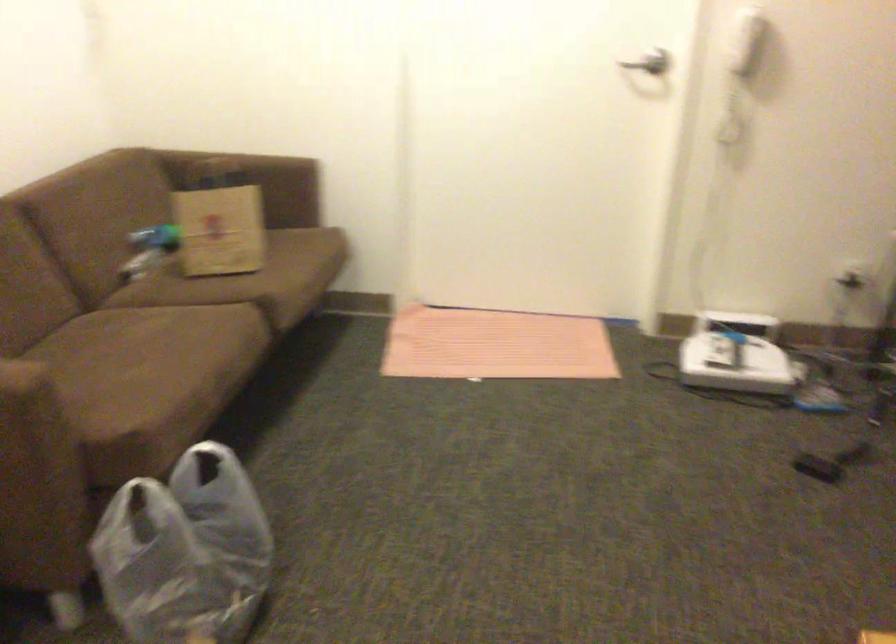
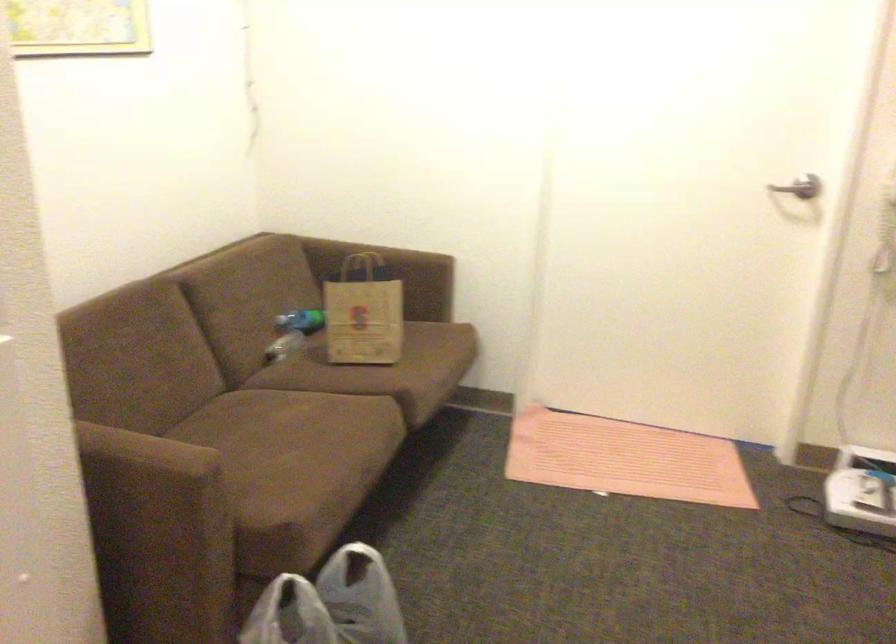
Question: In a continuous first-person perspective shot, in which direction is the camera moving?

Choices:
 (A) Left
 (B) Right
 (C) Forward
 (D) Backward

Answer: (A)